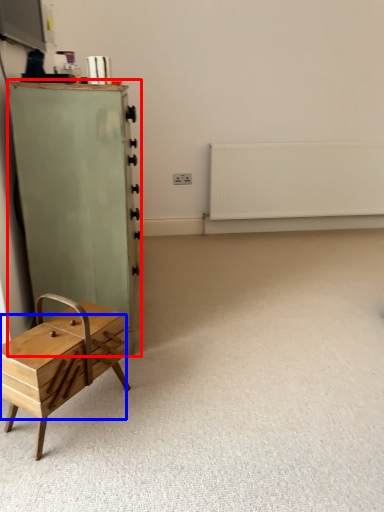
Question: Which object is closer to the camera taking this photo, chest of drawers (highlighted by a red box) or drawer (highlighted by a blue box)?

Choices:
 (A) chest of drawers
 (B) drawer

Answer: (B)